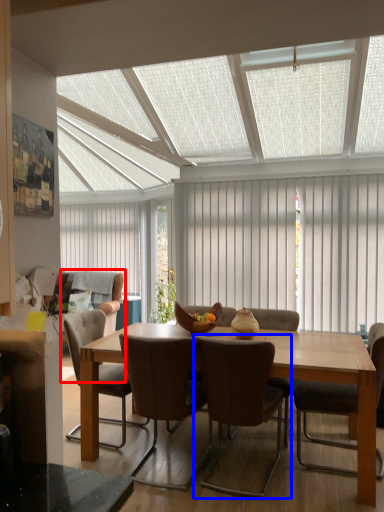
Question: Which of the following is the farthest to the observer, couch (highlighted by a red box) or chair (highlighted by a blue box)?

Choices:
 (A) couch
 (B) chair

Answer: (A)